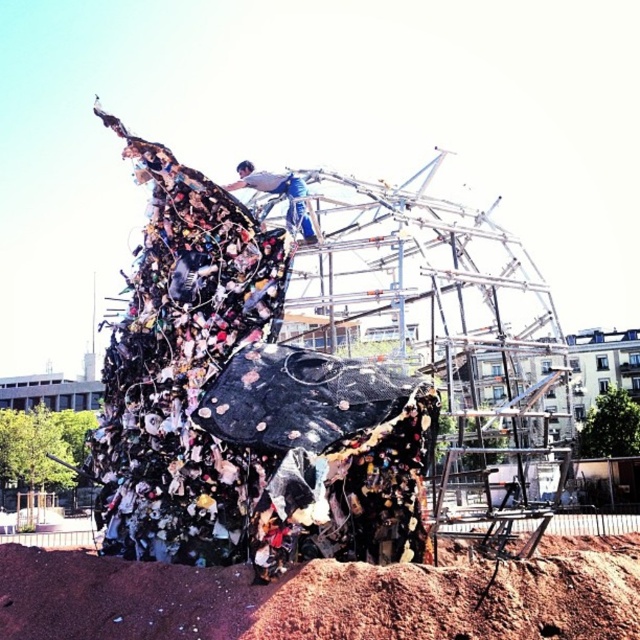
You are an artist standing in front of the sculpture and want to place a new decorative element between the brown dirt mound at lower center and the white fabric at upper center. Based on their positions, which object should you place the element closer to?

The brown dirt mound at lower center is positioned on the right side of white fabric at upper center. Therefore, to place the element between them, you should position it closer to the brown dirt mound at lower center since it is on the right side of the white fabric at upper center.

You are an art critic standing at the base of the sculpture. You notice the brown dirt mound at lower center and the white fabric at upper center. Which object is closer to you?

The brown dirt mound at lower center is closer to you because it is in front of the white fabric at upper center.